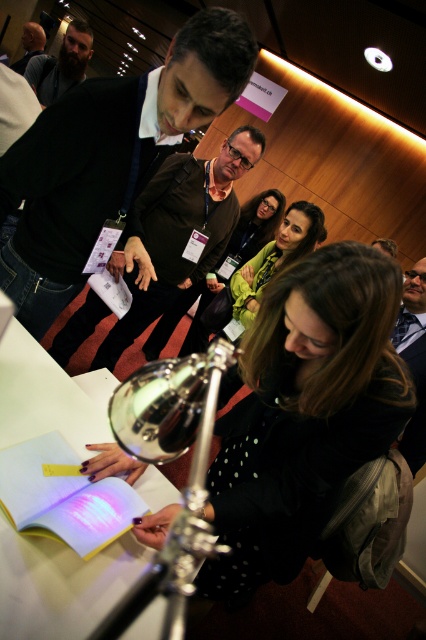
Question: Estimate the real-world distances between objects in this image. Which object is closer to the dark brown leather jacket at upper left?

Choices:
 (A) bearded man at upper left
 (B) white paper at center

Answer: (A)

Question: Does black dotted dress at center appear on the left side of green matte jacket at center?

Choices:
 (A) no
 (B) yes

Answer: (B)

Question: Is dark brown leather jacket at center to the left of matte black jacket at center from the viewer's perspective?

Choices:
 (A) no
 (B) yes

Answer: (B)

Question: Does matte black jacket at center appear on the right side of bearded man at upper left?

Choices:
 (A) no
 (B) yes

Answer: (B)

Question: Which is farther from the dark brown leather jacket at upper left?

Choices:
 (A) bearded man at upper left
 (B) black dotted dress at center

Answer: (B)

Question: Among these objects, which one is nearest to the camera?

Choices:
 (A) matte black jacket at center
 (B) bearded man at upper left
 (C) black dotted dress at center
 (D) dark brown leather jacket at center

Answer: (C)